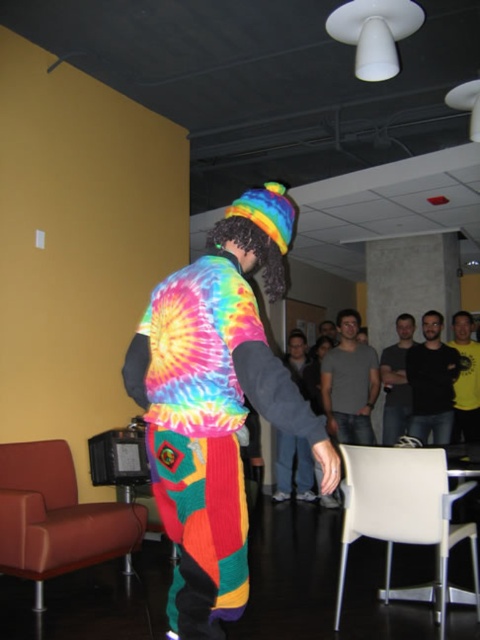
Question: Which point is closer to the camera taking this photo?

Choices:
 (A) (233, 436)
 (B) (468, 424)
 (C) (339, 324)
 (D) (398, 396)

Answer: (A)

Question: Which point is closer to the camera?

Choices:
 (A) tie-dye fabric pants at center
 (B) rainbow tie-dye sweater at center
 (C) yellow t-shirt at center

Answer: (A)

Question: Which point appears closest to the camera in this image?

Choices:
 (A) (459, 413)
 (B) (286, 461)
 (C) (75, 552)
 (D) (414, 538)

Answer: (D)

Question: Does white plastic chair at lower right lie in front of gray cotton t-shirt at center?

Choices:
 (A) no
 (B) yes

Answer: (B)

Question: Is tie-dye fabric pants at center thinner than gray cotton t-shirt at center?

Choices:
 (A) yes
 (B) no

Answer: (B)

Question: Is leather-like brown chair at lower left smaller than dark gray cotton shirt at center?

Choices:
 (A) yes
 (B) no

Answer: (A)